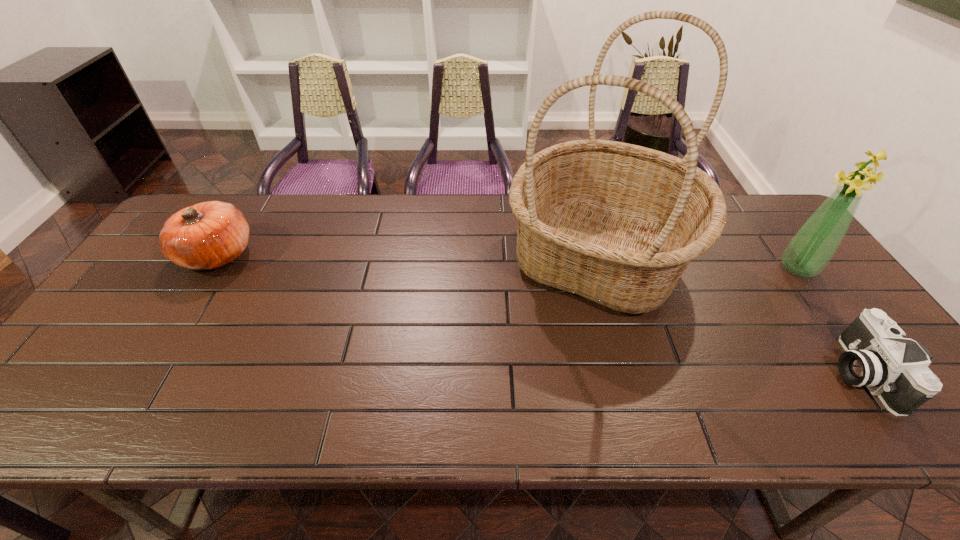
Identify the location of free spot between the tallest object and the third shortest object. (699, 262).

You are a GUI agent. You are given a task and a screenshot of the screen. Output one action in this format:
    pyautogui.click(x=<x>, y=<y>)
    Task: Click on the unoccupied area between the nearest object and the second tallest object
    
    Given the screenshot: What is the action you would take?
    pyautogui.click(x=829, y=320)

You are a GUI agent. You are given a task and a screenshot of the screen. Output one action in this format:
    pyautogui.click(x=<x>, y=<y>)
    Task: Click on the vacant region between the third shortest object and the nearest object
    This screenshot has width=960, height=540.
    Given the screenshot: What is the action you would take?
    pyautogui.click(x=829, y=320)

Where is `empty space between the bouquet and the leftmost object`? empty space between the bouquet and the leftmost object is located at coordinates (508, 261).

At what (x,y) coordinates should I click in order to perform the action: click on empty location between the second object from left to right and the pumpkin. Please return your answer as a coordinate pair (x, y). This screenshot has height=540, width=960. Looking at the image, I should click on (408, 256).

What are the coordinates of `blank region between the second object from left to right and the leftmost object` in the screenshot? It's located at (408, 256).

Locate which object is the closest to the bouquet. Please provide its 2D coordinates. Your answer should be formatted as a tuple, i.e. [(x, y)], where the tuple contains the x and y coordinates of a point satisfying the conditions above.

[(876, 356)]

Where is `object that can be found as the third closest to the second tallest object`? This screenshot has width=960, height=540. object that can be found as the third closest to the second tallest object is located at coordinates (205, 236).

You are a GUI agent. You are given a task and a screenshot of the screen. Output one action in this format:
    pyautogui.click(x=<x>, y=<y>)
    Task: Click on the free location that satisfies the following two spatial constraints: 1. on the front side of the pumpkin; 2. on the left side of the shortest object
    The height and width of the screenshot is (540, 960).
    Given the screenshot: What is the action you would take?
    pyautogui.click(x=144, y=373)